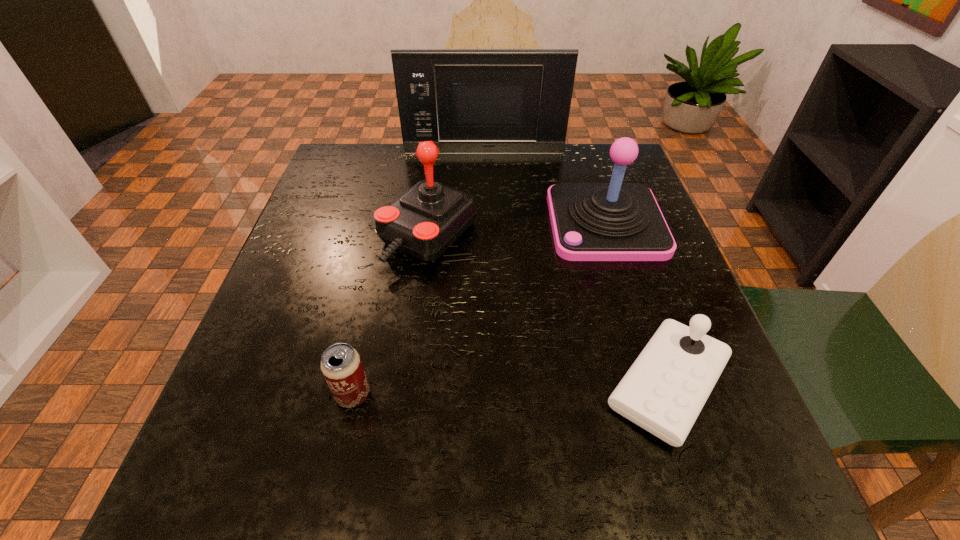
At what (x,y) coordinates should I click in order to perform the action: click on the farthest object. Please return your answer as a coordinate pair (x, y). Image resolution: width=960 pixels, height=540 pixels. Looking at the image, I should click on (467, 101).

This screenshot has height=540, width=960. Identify the location of microwave oven. (467, 101).

What are the coordinates of `the leftmost joystick` in the screenshot? It's located at (426, 220).

In order to click on the shortest joystick in this screenshot , I will do `click(665, 389)`.

Where is `beer can`? The width and height of the screenshot is (960, 540). beer can is located at coordinates (341, 365).

At what (x,y) coordinates should I click in order to perform the action: click on vacant area located on the front panel of the farthest object. Please return your answer as a coordinate pair (x, y). This screenshot has height=540, width=960. Looking at the image, I should click on (484, 184).

Locate an element on the screen. blank area located on the right of the leftmost joystick is located at coordinates (605, 235).

This screenshot has height=540, width=960. I want to click on vacant area located on the back of the shortest joystick, so click(631, 274).

This screenshot has height=540, width=960. In order to click on free space located 0.090m on the right of the beer can in this screenshot , I will do `click(427, 395)`.

Identify the location of microwave oven that is positioned at the far edge. The width and height of the screenshot is (960, 540). (467, 101).